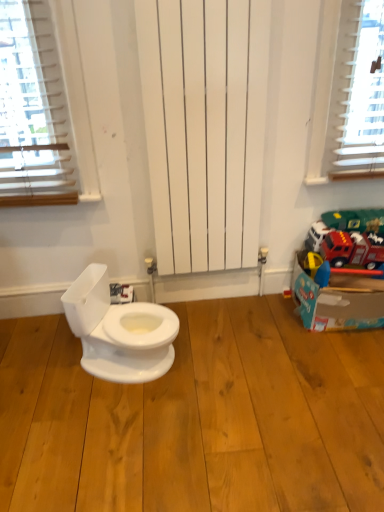
Question: Considering the relative positions of cardboard box at right and light brown wood flooring at center in the image provided, is cardboard box at right to the right of light brown wood flooring at center from the viewer's perspective?

Choices:
 (A) no
 (B) yes

Answer: (B)

Question: Does cardboard box at right have a smaller size compared to light brown wood flooring at center?

Choices:
 (A) no
 (B) yes

Answer: (B)

Question: Is cardboard box at right thinner than light brown wood flooring at center?

Choices:
 (A) yes
 (B) no

Answer: (A)

Question: Can you confirm if cardboard box at right is shorter than light brown wood flooring at center?

Choices:
 (A) yes
 (B) no

Answer: (B)

Question: Does cardboard box at right have a greater width compared to light brown wood flooring at center?

Choices:
 (A) yes
 (B) no

Answer: (B)

Question: Is the surface of cardboard box at right in direct contact with light brown wood flooring at center?

Choices:
 (A) yes
 (B) no

Answer: (B)

Question: From the image's perspective, is light brown wood flooring at center beneath cardboard box at right?

Choices:
 (A) no
 (B) yes

Answer: (B)

Question: Is light brown wood flooring at center looking in the opposite direction of cardboard box at right?

Choices:
 (A) no
 (B) yes

Answer: (A)

Question: From the image's perspective, is light brown wood flooring at center over cardboard box at right?

Choices:
 (A) yes
 (B) no

Answer: (B)

Question: From a real-world perspective, is light brown wood flooring at center positioned under cardboard box at right based on gravity?

Choices:
 (A) yes
 (B) no

Answer: (A)

Question: Is light brown wood flooring at center to the right of cardboard box at right from the viewer's perspective?

Choices:
 (A) no
 (B) yes

Answer: (A)

Question: Does light brown wood flooring at center have a smaller size compared to cardboard box at right?

Choices:
 (A) no
 (B) yes

Answer: (A)

Question: Is cardboard box at right taller or shorter than light brown wood flooring at center?

Choices:
 (A) tall
 (B) short

Answer: (A)